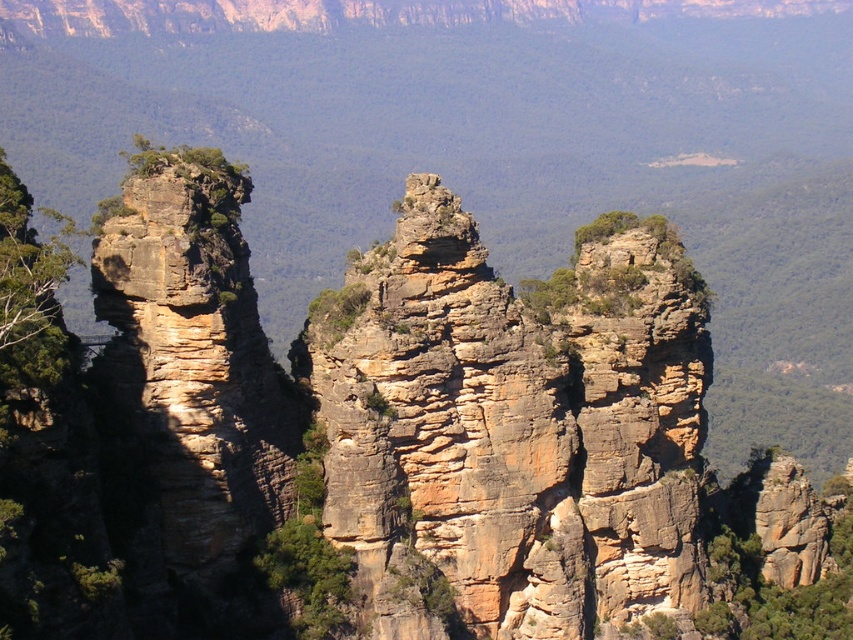
You are standing at the bottom of the valley looking up at the rustic stone rock formation at center. If you were to walk directly towards it, would you need to move north, south, east, or west?

Since the rustic stone rock formation at center is located at the center of the scene, you would need to move directly towards it without needing to adjust your direction north, south, east, or west. However, based on the coordinate provided, the rock formation is positioned at point 0.667 on the x and 0.604 on the y axis. Assuming the coordinate system places the origin at the bottom left corner, moving towards the center would generally involve moving north. But since it is already at center, precise path

You are a hiker planning to cross between the rustic stone rock formation at center and the green rough rock at center. The path between them is 3 meters wide. If your tent is 2.5 meters wide, can you safely set up your tent there without it overlapping either rock formation?

The rustic stone rock formation at center is wider than the green rough rock at center. Since the path between them is 3 meters wide and your tent is 2.5 meters wide, there should be enough space to set up the tent without overlapping either rock formation.